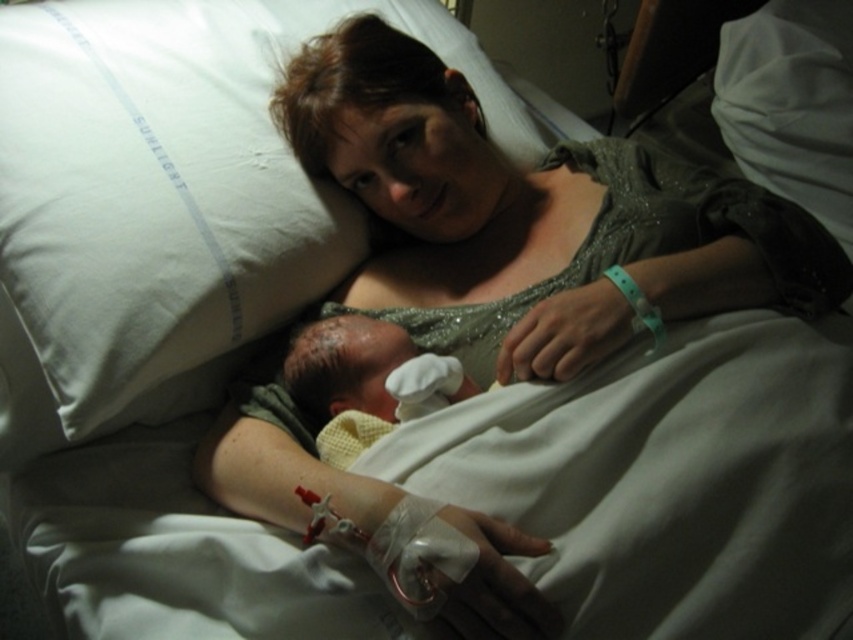
Can you confirm if white soft pillow at upper left is positioned below yellow textured blanket at center?

No, white soft pillow at upper left is not below yellow textured blanket at center.

Who is taller, white soft pillow at upper left or yellow textured blanket at center?

white soft pillow at upper left

Between point (6, 234) and point (369, 342), which one is positioned in front?

Point (6, 234)

The image size is (853, 640). I want to click on white soft pillow at upper left, so click(167, 198).